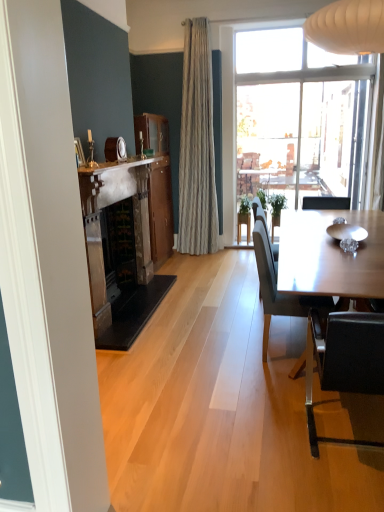
What are the coordinates of `vacant region below dark gray fabric chair at right, marked as the 2th chair in a front-to-back arrangement (from a real-world perspective)` in the screenshot? It's located at (288, 354).